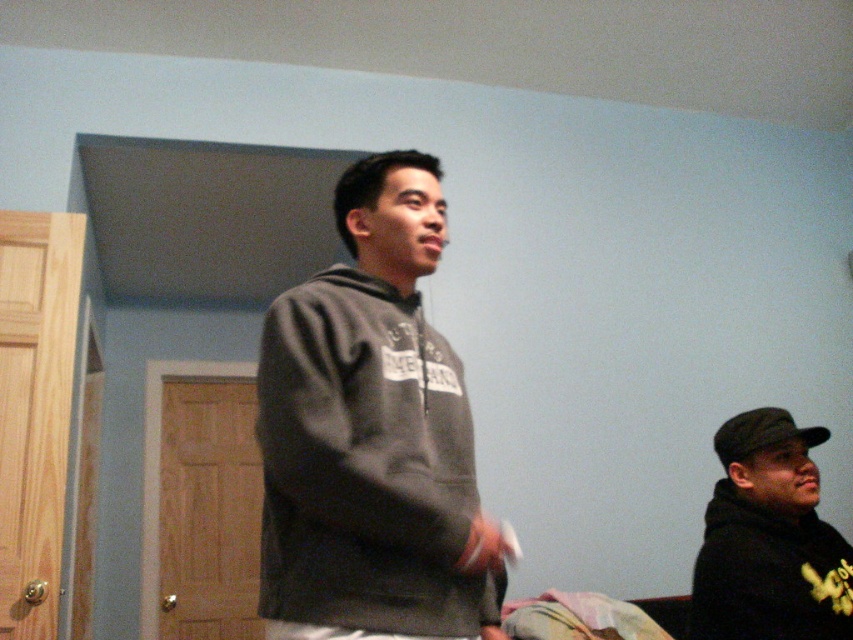
Is point (265, 570) less distant than point (772, 598)?

Yes.

Does dark gray hoodie at center appear on the left side of black matte hoodie at lower right?

Yes, dark gray hoodie at center is to the left of black matte hoodie at lower right.

Who is more distant from viewer, (401, 330) or (722, 557)?

The point (722, 557) is more distant.

The image size is (853, 640). I want to click on dark gray hoodie at center, so click(x=372, y=433).